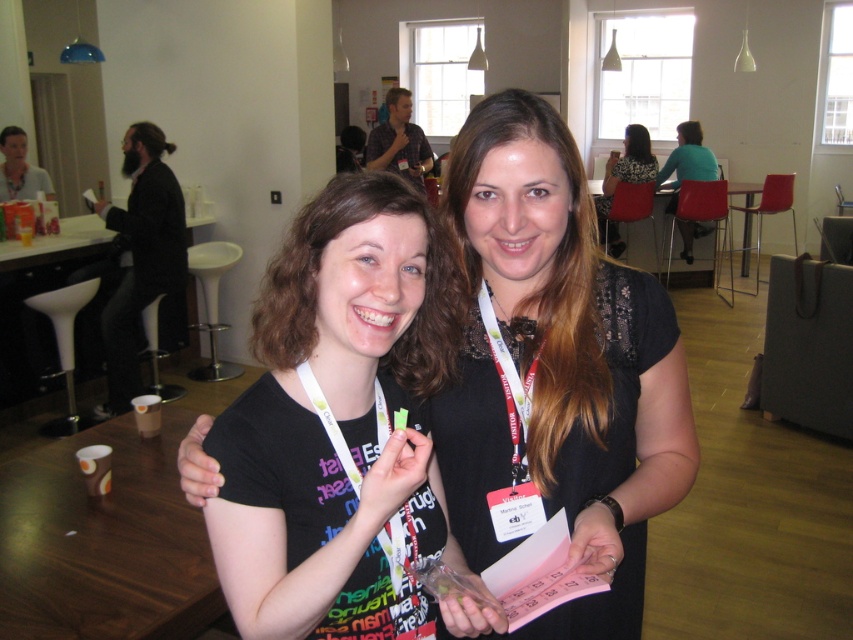
You are standing in front of the two women in the image. The white fabric lanyard at center is at point 0.605, 0.599. If you want to hand them a document, which direction should you walk to reach the lanyard?

The white fabric lanyard at center is located at coordinates (509,387), so you should walk towards the center of the image to reach it.

You are at an event and need to locate the green matte paper at center and the teal fabric shirt at upper right. Based on their positions, which object is closer to the bottom of the image?

The green matte paper at center is closer to the bottom of the image because it is located below the teal fabric shirt at upper right.